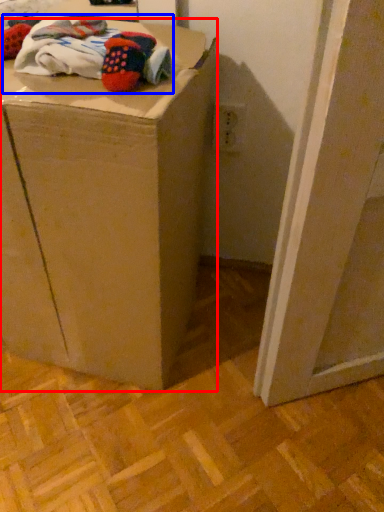
Question: Which object is further to the camera taking this photo, furniture (highlighted by a red box) or laundry (highlighted by a blue box)?

Choices:
 (A) furniture
 (B) laundry

Answer: (B)